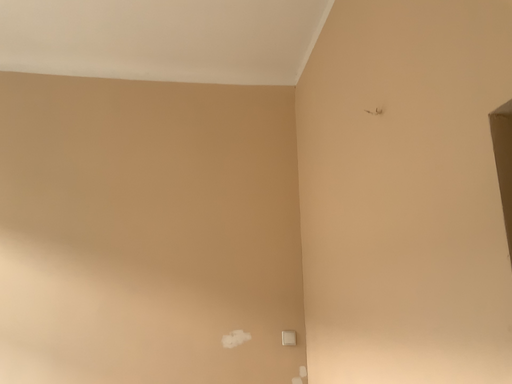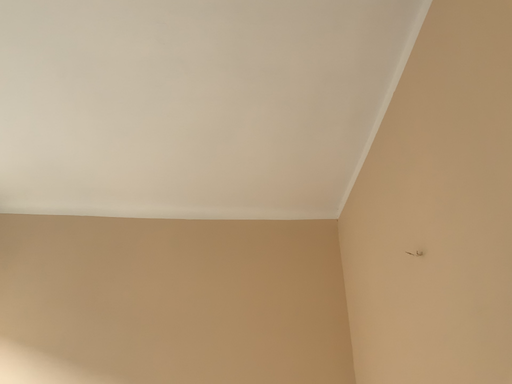
Question: How did the camera likely rotate when shooting the video?

Choices:
 (A) rotated upward
 (B) rotated downward

Answer: (A)